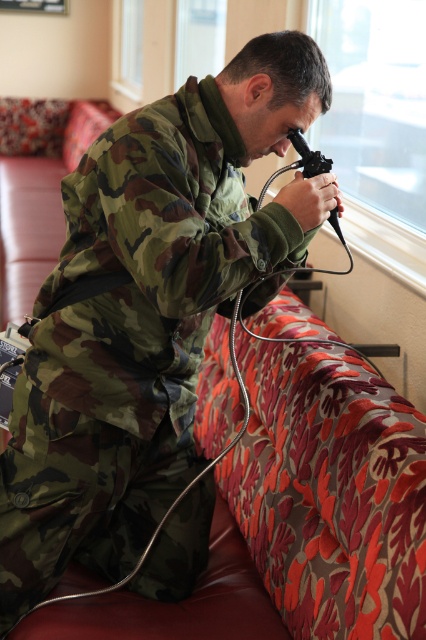
Is transparent glass window at upper center in front of floral fabric couch at lower left?

Yes, transparent glass window at upper center is closer to the viewer.

Does transparent glass window at upper center have a greater height compared to floral fabric couch at lower left?

Yes, transparent glass window at upper center is taller than floral fabric couch at lower left.

Between point (328, 65) and point (17, 200), which one is positioned in front?

Positioned in front is point (17, 200).

Where is `transparent glass window at upper center`? transparent glass window at upper center is located at coordinates (377, 125).